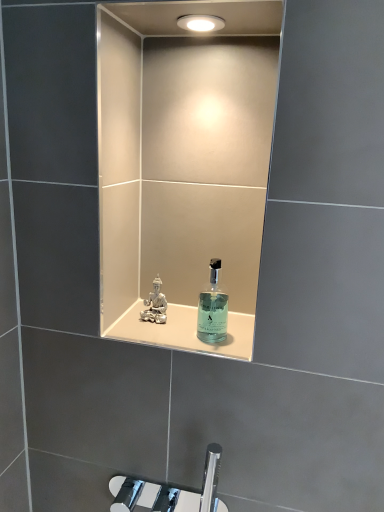
Find the location of a particular element. The height and width of the screenshot is (512, 384). unoccupied area behind transparent glass bottle at center is located at coordinates (206, 324).